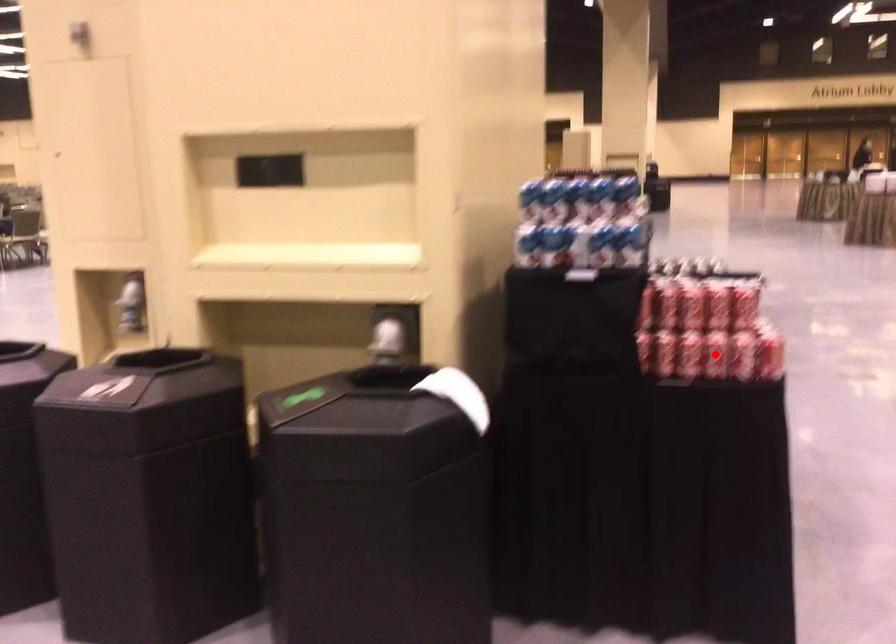
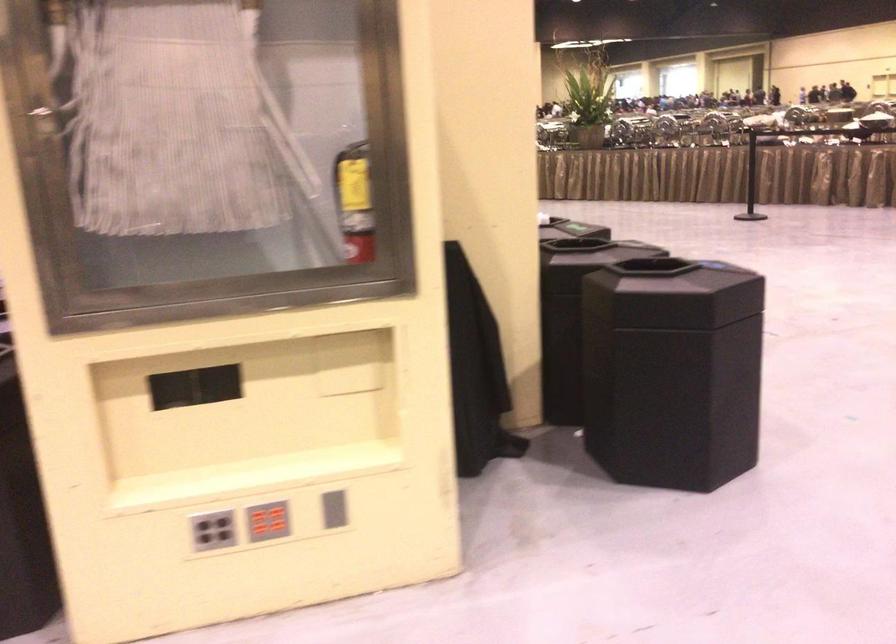
Question: I am providing you with two images of the same scene from different viewpoints. A red point is marked on the first image. At the location where the point appears in image 1, is it still visible in image 2?

Choices:
 (A) Yes
 (B) No

Answer: (B)